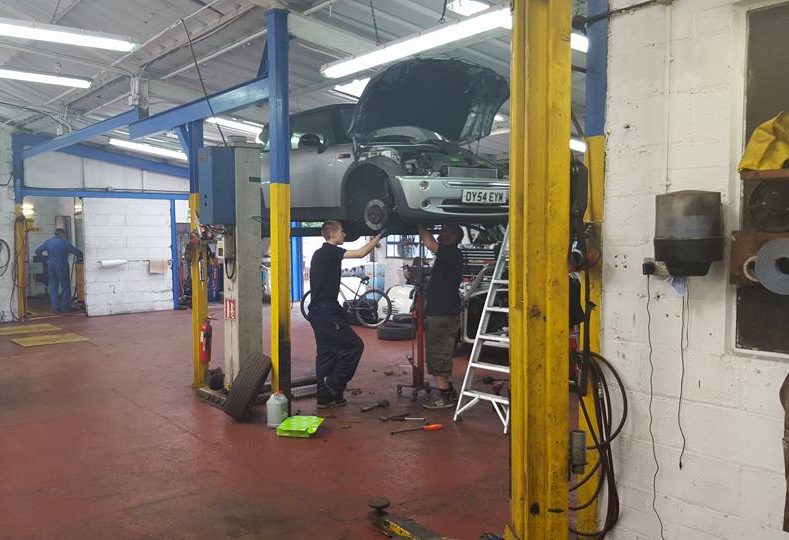
Find the location of a particular element. The height and width of the screenshot is (540, 789). towel dispenser is located at coordinates (678, 238).